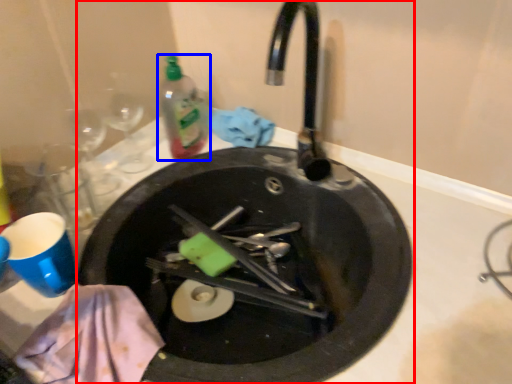
Question: Which object is closer to the camera taking this photo, sink (highlighted by a red box) or bottle (highlighted by a blue box)?

Choices:
 (A) sink
 (B) bottle

Answer: (A)